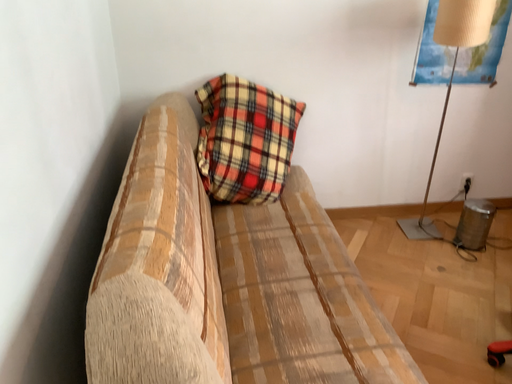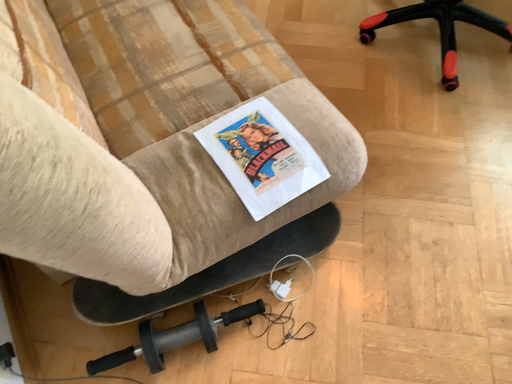
Question: How did the camera likely rotate when shooting the video?

Choices:
 (A) rotated left
 (B) rotated right

Answer: (B)